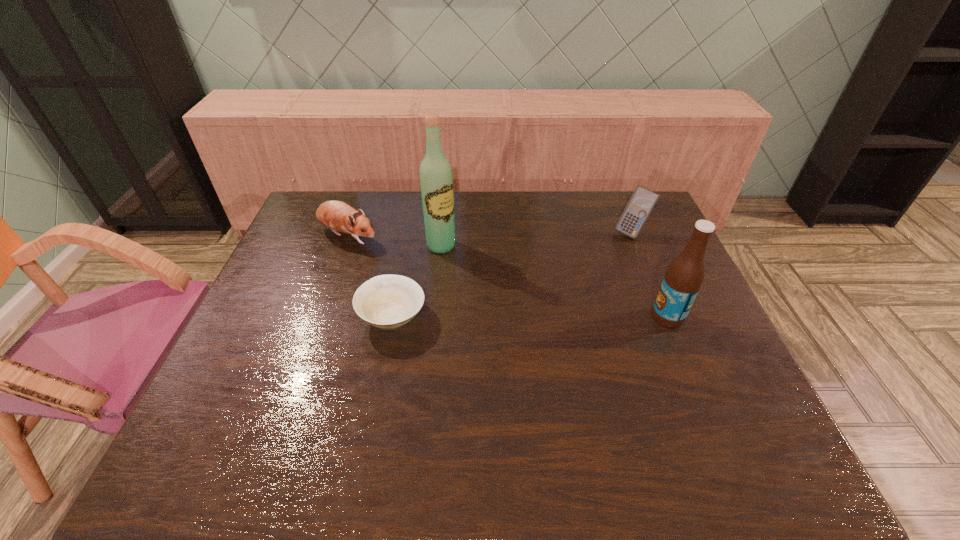
Find the location of a particular element. This screenshot has width=960, height=540. calculator that is at the right edge is located at coordinates (642, 202).

The width and height of the screenshot is (960, 540). I want to click on object positioned at the far left corner, so click(x=338, y=216).

Identify the location of object that is at the far right corner. This screenshot has height=540, width=960. (642, 202).

Locate an element on the screen. The image size is (960, 540). free space at the far edge is located at coordinates (590, 228).

Image resolution: width=960 pixels, height=540 pixels. What are the coordinates of `free space at the near edge of the desktop` in the screenshot? It's located at (429, 389).

At what (x,y) coordinates should I click in order to perform the action: click on vacant space at the left edge of the desktop. Please return your answer as a coordinate pair (x, y). Looking at the image, I should click on (261, 301).

Where is `vacant space at the right edge of the desktop`? Image resolution: width=960 pixels, height=540 pixels. vacant space at the right edge of the desktop is located at coordinates (714, 327).

Where is `vacant space at the far left corner of the desktop`? The height and width of the screenshot is (540, 960). vacant space at the far left corner of the desktop is located at coordinates (327, 198).

I want to click on free spot between the second shortest object and the calculator, so click(490, 234).

The width and height of the screenshot is (960, 540). Find the location of `unoccupied area between the beer bottle and the calculator`. unoccupied area between the beer bottle and the calculator is located at coordinates (650, 274).